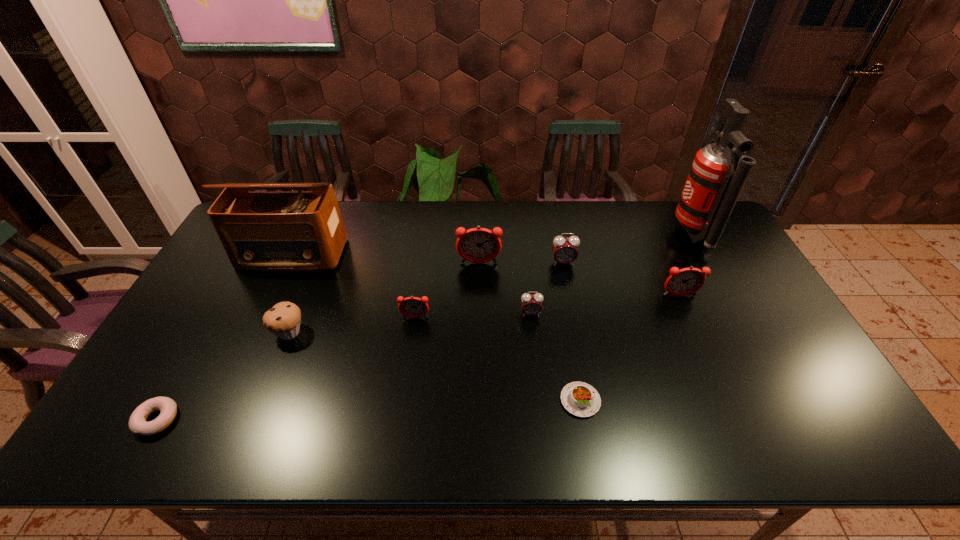
This screenshot has width=960, height=540. I want to click on vacant space at the left edge of the desktop, so click(134, 393).

Where is `free space at the right edge`? The height and width of the screenshot is (540, 960). free space at the right edge is located at coordinates (808, 412).

The height and width of the screenshot is (540, 960). What are the coordinates of `vacant space in between the farther pink alarm clock and the fifth object from left to right` in the screenshot? It's located at (521, 263).

I want to click on empty location between the tallest object and the fourth alarm clock from left to right, so click(x=629, y=248).

Find the location of a particular element. The width and height of the screenshot is (960, 540). free spot between the pudding and the tallest alarm clock is located at coordinates (530, 332).

Where is `free spot between the muffin and the rightmost alarm clock`? free spot between the muffin and the rightmost alarm clock is located at coordinates (484, 314).

Identify the location of vacant space in between the doughnut and the ninth shortest object. (225, 338).

This screenshot has width=960, height=540. I want to click on empty space that is in between the fire extinguisher and the muffin, so click(492, 283).

This screenshot has width=960, height=540. Identify the location of free spot between the muffin and the doughnut. (223, 376).

Locate an element on the screen. The height and width of the screenshot is (540, 960). vacant area that lies between the muffin and the third alarm clock from left to right is located at coordinates (410, 323).